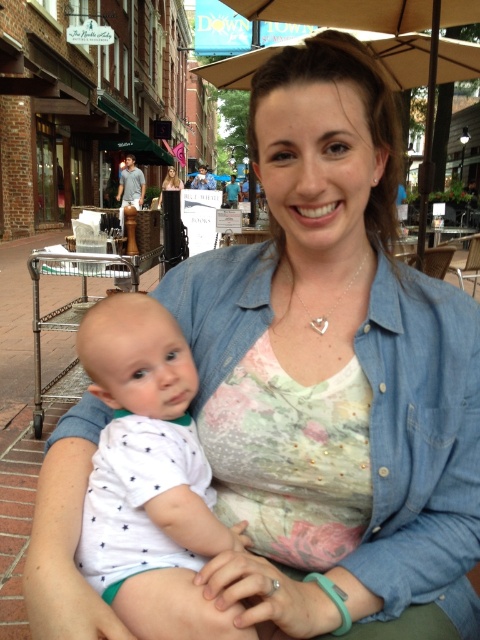
You are a photographer standing at the scene wanting to take a photo of the denim shirt at center and the beige fabric umbrella at upper center. If your camera can only focus on objects within 8 feet, will both objects be in focus?

The distance between the denim shirt at center and the beige fabric umbrella at upper center is 7.72 feet, which is within the camera focus range of 8 feet. Therefore, both objects will be in focus.

You are a photographer trying to capture a closeup of the baby in the white soft fabric baby at center. You notice the beige fabric umbrella at upper center might block the shot. Can you determine if the baby is thinner than the umbrella?

The white soft fabric baby at center is thinner than the beige fabric umbrella at upper center, so the baby is thinner and might not be fully blocked by the umbrella.

You are a photographer trying to capture the woman and the baby in the image. If you want to focus on the denim shirt at center, where should you aim your camera? Please provide the coordinates from the scene description.

The denim shirt at center is located at coordinates point (x=422, y=452), so you should aim your camera at that point to focus on the denim shirt at center.